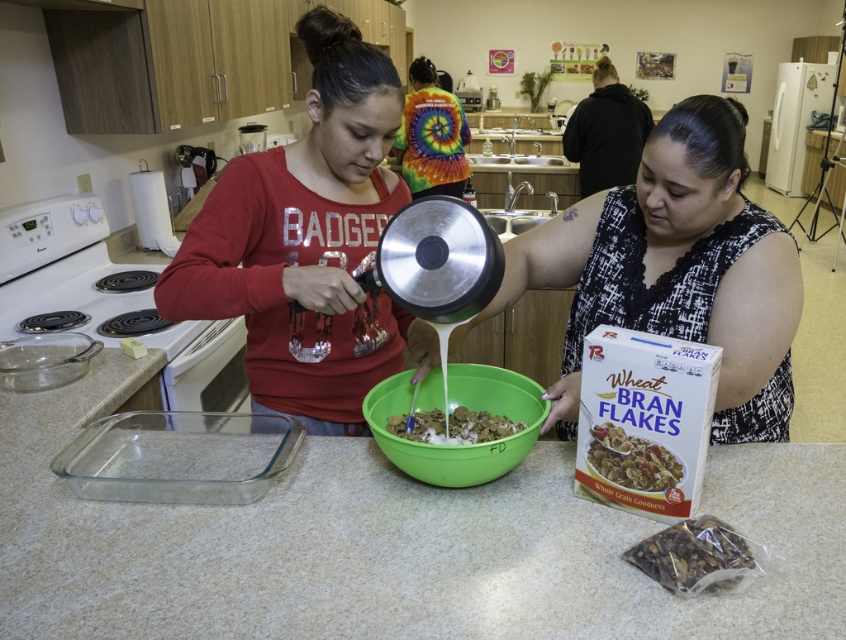
Question: Which point is farther to the camera?

Choices:
 (A) (257, 337)
 (B) (437, 588)
 (C) (652, 536)

Answer: (A)

Question: Can you confirm if green plastic bowl at center is positioned to the left of white cardboard wheat bran flakes at lower right?

Choices:
 (A) no
 (B) yes

Answer: (B)

Question: Considering the real-world distances, which object is farthest from the green plastic bowl at center?

Choices:
 (A) smooth white countertop at center
 (B) shiny metallic pot at center
 (C) white cardboard wheat bran flakes at lower right
 (D) matte brown cereal at center

Answer: (B)

Question: Is shiny metallic pot at center in front of matte brown cereal at center?

Choices:
 (A) yes
 (B) no

Answer: (A)

Question: Which of the following is the closest to the observer?

Choices:
 (A) (443, 458)
 (B) (347, 381)
 (C) (440, 420)

Answer: (A)

Question: Can you confirm if green plastic bowl at center is positioned above white cardboard wheat bran flakes at lower right?

Choices:
 (A) no
 (B) yes

Answer: (B)